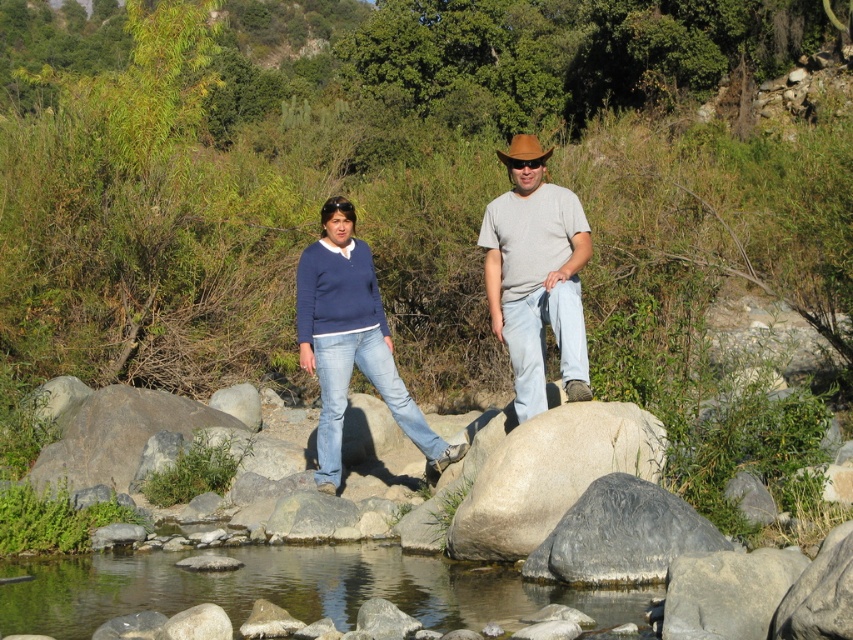
Between smooth gray rock at center and brown felt cowboy hat at center, which one appears on the right side from the viewer's perspective?

Positioned to the right is brown felt cowboy hat at center.

Where is `smooth gray rock at center`? smooth gray rock at center is located at coordinates (550, 474).

Who is more distant from viewer, (x=503, y=497) or (x=672, y=499)?

The point (x=503, y=497) is more distant.

Is smooth gray rock at center smaller than gray rough boulder at lower center?

No, smooth gray rock at center is not smaller than gray rough boulder at lower center.

Does point (653, 465) lie behind point (612, 490)?

Yes.

Identify the location of smooth gray rock at center. Image resolution: width=853 pixels, height=640 pixels. (550, 474).

Does matte gray t-shirt at center have a larger size compared to blue denim jeans at center?

Yes.

Between matte gray t-shirt at center and blue denim jeans at center, which one has more height?

blue denim jeans at center is taller.

Between point (505, 326) and point (398, 413), which one is positioned behind?

Positioned behind is point (398, 413).

Identify the location of matte gray t-shirt at center. (537, 275).